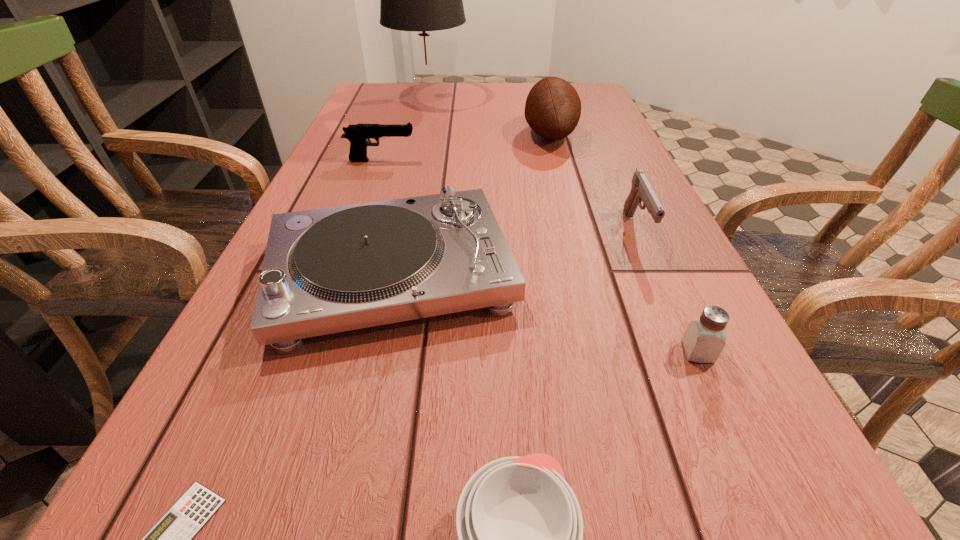
Where is `record player located in the left edge section of the desktop`? record player located in the left edge section of the desktop is located at coordinates (328, 270).

This screenshot has width=960, height=540. Find the location of `football present at the right edge`. football present at the right edge is located at coordinates (553, 107).

The height and width of the screenshot is (540, 960). Identify the location of pistol that is at the right edge. (641, 190).

Image resolution: width=960 pixels, height=540 pixels. I want to click on saltshaker that is at the right edge, so click(704, 339).

The height and width of the screenshot is (540, 960). I want to click on object situated at the far left corner, so click(419, 0).

In the image, there is a desktop. Where is `vacant space at the far edge`? The width and height of the screenshot is (960, 540). vacant space at the far edge is located at coordinates (446, 97).

You are a GUI agent. You are given a task and a screenshot of the screen. Output one action in this format:
    pyautogui.click(x=<x>, y=<y>)
    Task: Click on the vacant space at the right edge of the desktop
    
    Given the screenshot: What is the action you would take?
    pyautogui.click(x=743, y=373)

The image size is (960, 540). I want to click on free space between the left pistol and the sixth tallest object, so click(540, 256).

I want to click on free space between the record player and the right pistol, so [514, 252].

Identify the location of free space between the nearer pistol and the saltshaker. coord(666,291).